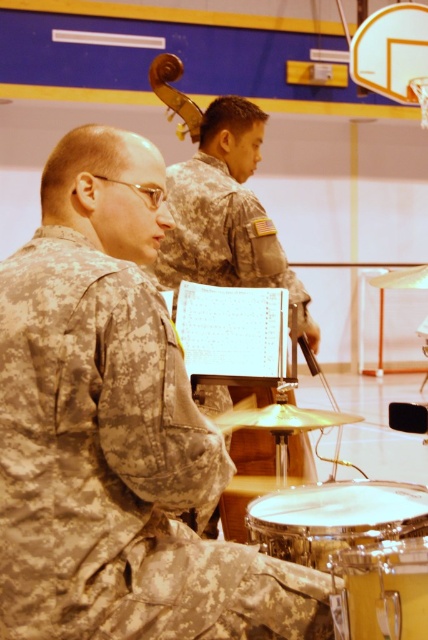
You are a photographer setting up for a group photo in the gymnasium. You need to position your camera so that both the camouflage fabric uniform at left and the yellow drum at lower right are in frame. Considering their sizes, which object should you ensure is closer to the camera to maintain both in the shot without cropping?

The camouflage fabric uniform at left is bigger than the yellow drum at lower right. To keep both in frame without cropping, position the larger camouflage fabric uniform at left closer to the camera so its size matches the yellow drum at lower right in the shot.

You are a photographer setting up for a military band performance. You need to position a spotlight so it shines on both the camouflage uniform at left and the yellow drum at lower right. Based on their positions, will the spotlight need to be angled upwards or downwards to illuminate both?

The camouflage uniform at left is above the yellow drum at lower right, so the spotlight should be angled downwards to illuminate both.

You are a photographer setting up for a group photo in the gymnasium. You need to ensure that both the camouflage uniform at left and the yellow drum at lower right are visible in the frame. Given their height difference, which object should you position closer to the camera to maintain visibility?

The camouflage uniform at left is taller than the yellow drum at lower right. To ensure both are visible, position the yellow drum at lower right closer to the camera so its smaller size doesn not get lost against the background.